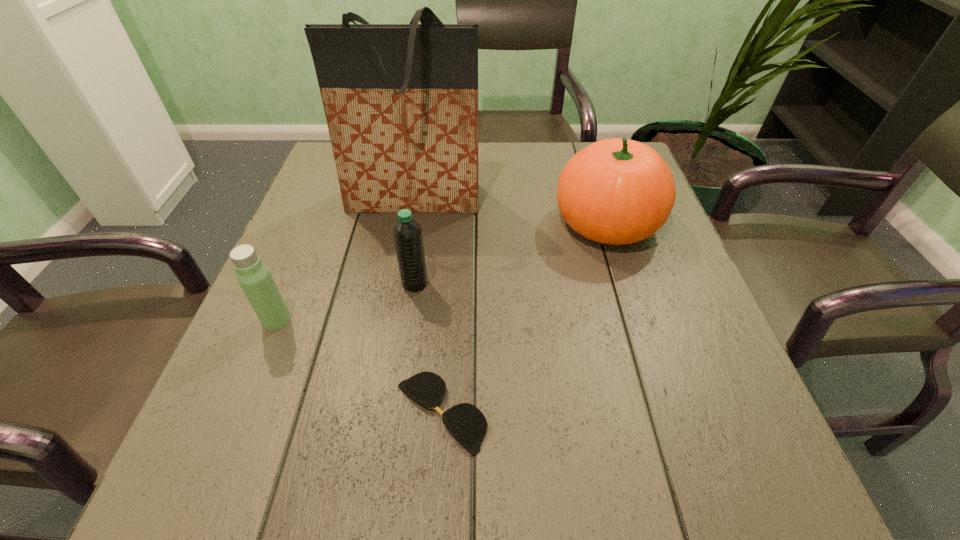
This screenshot has width=960, height=540. I want to click on empty space that is in between the water bottle and the pumpkin, so [511, 253].

I want to click on vacant area that lies between the tallest object and the fourth shortest object, so click(511, 211).

At what (x,y) coordinates should I click in order to perform the action: click on vacant area between the water bottle and the leftmost object. Please return your answer as a coordinate pair (x, y). Image resolution: width=960 pixels, height=540 pixels. Looking at the image, I should click on (346, 302).

You are a GUI agent. You are given a task and a screenshot of the screen. Output one action in this format:
    pyautogui.click(x=<x>, y=<y>)
    Task: Click on the free space between the leftmost object and the spectacles
    This screenshot has width=960, height=540.
    Given the screenshot: What is the action you would take?
    pyautogui.click(x=359, y=366)

Locate an element on the screen. unoccupied position between the tallest object and the pumpkin is located at coordinates (511, 211).

You are a GUI agent. You are given a task and a screenshot of the screen. Output one action in this format:
    pyautogui.click(x=<x>, y=<y>)
    Task: Click on the free space between the pumpkin and the spectacles
    
    Given the screenshot: What is the action you would take?
    pyautogui.click(x=524, y=318)

Point out which object is positioned as the nearest to the second tallest object. Please provide its 2D coordinates. Your answer should be formatted as a tuple, i.e. [(x, y)], where the tuple contains the x and y coordinates of a point satisfying the conditions above.

[(401, 100)]

Identify which object is located as the second nearest to the tallest object. Please provide its 2D coordinates. Your answer should be formatted as a tuple, i.e. [(x, y)], where the tuple contains the x and y coordinates of a point satisfying the conditions above.

[(616, 191)]

The width and height of the screenshot is (960, 540). What are the coordinates of `free space that satisfies the following two spatial constraints: 1. on the back side of the leftmost object; 2. on the right side of the fourth shortest object` in the screenshot? It's located at (316, 222).

This screenshot has width=960, height=540. In order to click on vacant area that satisfies the following two spatial constraints: 1. on the front side of the leftmost object; 2. on the left side of the nearest object in this screenshot , I will do `click(239, 412)`.